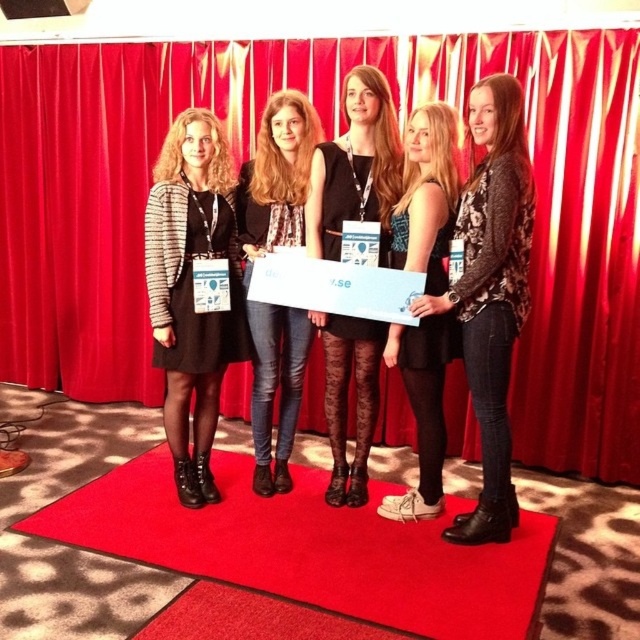
Question: Is red velvet curtain at center behind red carpet at center?

Choices:
 (A) no
 (B) yes

Answer: (B)

Question: Is patterned sweater at center to the left of matte black jacket at center from the viewer's perspective?

Choices:
 (A) no
 (B) yes

Answer: (A)

Question: Is red carpet at center below matte black jacket at center?

Choices:
 (A) yes
 (B) no

Answer: (A)

Question: Which is nearer to the black lace tights at center?

Choices:
 (A) patterned sweater at center
 (B) red velvet curtain at center
 (C) matte black dress at center

Answer: (C)

Question: Which point appears farthest from the camera in this image?

Choices:
 (A) (285, 330)
 (B) (234, 285)

Answer: (A)

Question: Which point appears farthest from the camera in this image?

Choices:
 (A) (422, 266)
 (B) (317, 204)

Answer: (B)